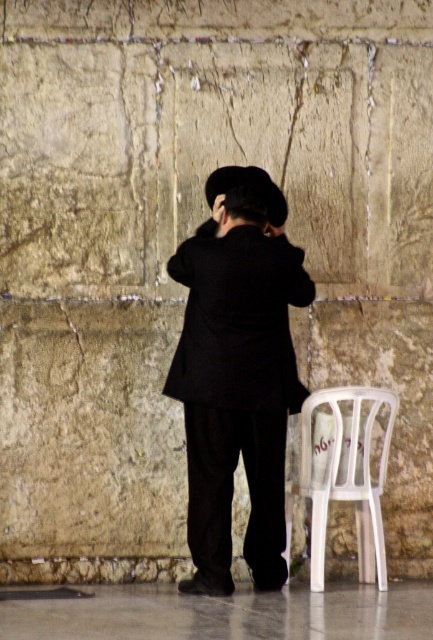
Question: Does matte black coat at center have a lesser width compared to white plastic chair at lower right?

Choices:
 (A) yes
 (B) no

Answer: (B)

Question: Which is farther from the black felt hat at center?

Choices:
 (A) matte black coat at center
 (B) white plastic chair at lower right

Answer: (B)

Question: Which point is farther to the camera?

Choices:
 (A) white plastic chair at lower right
 (B) matte black coat at center

Answer: (A)

Question: Does matte black coat at center appear on the right side of black felt hat at center?

Choices:
 (A) yes
 (B) no

Answer: (B)

Question: Which object appears farthest from the camera in this image?

Choices:
 (A) black felt hat at center
 (B) matte black coat at center
 (C) white plastic chair at lower right

Answer: (A)

Question: Can you confirm if white plastic chair at lower right is positioned to the right of black felt hat at center?

Choices:
 (A) yes
 (B) no

Answer: (A)